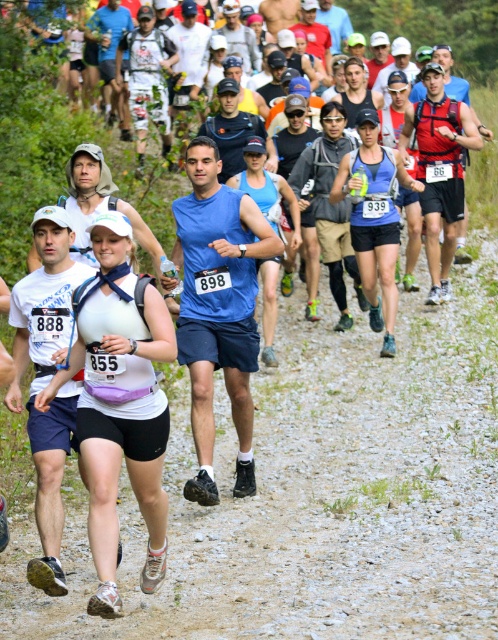
What do you see at coordinates (120, 404) in the screenshot?
I see `white matte tank top at center` at bounding box center [120, 404].

How much distance is there between white matte tank top at center and blue fabric tank top at center?

A distance of 1.64 meters exists between white matte tank top at center and blue fabric tank top at center.

Find the location of a particular element. white matte tank top at center is located at coordinates (120, 404).

This screenshot has height=640, width=498. What are the coordinates of `white matte tank top at center` in the screenshot? It's located at (120, 404).

Is the position of white fabric runner at center less distant than that of blue fabric tank top at center?

No, it is behind blue fabric tank top at center.

Locate an element on the screen. The height and width of the screenshot is (640, 498). white fabric runner at center is located at coordinates (316, 496).

Between white fabric runner at center and white matte tank top at center, which one has more height?

Standing taller between the two is white matte tank top at center.

Does white fabric runner at center have a lesser height compared to white matte tank top at center?

Correct, white fabric runner at center is not as tall as white matte tank top at center.

What are the coordinates of `white fabric runner at center` in the screenshot? It's located at (316, 496).

Image resolution: width=498 pixels, height=640 pixels. Find the location of `white fabric runner at center`. white fabric runner at center is located at coordinates (316, 496).